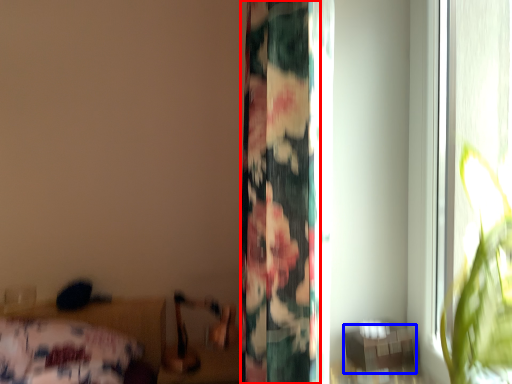
Question: Which object appears closest to the camera in this image, curtain (highlighted by a red box) or table (highlighted by a blue box)?

Choices:
 (A) curtain
 (B) table

Answer: (A)